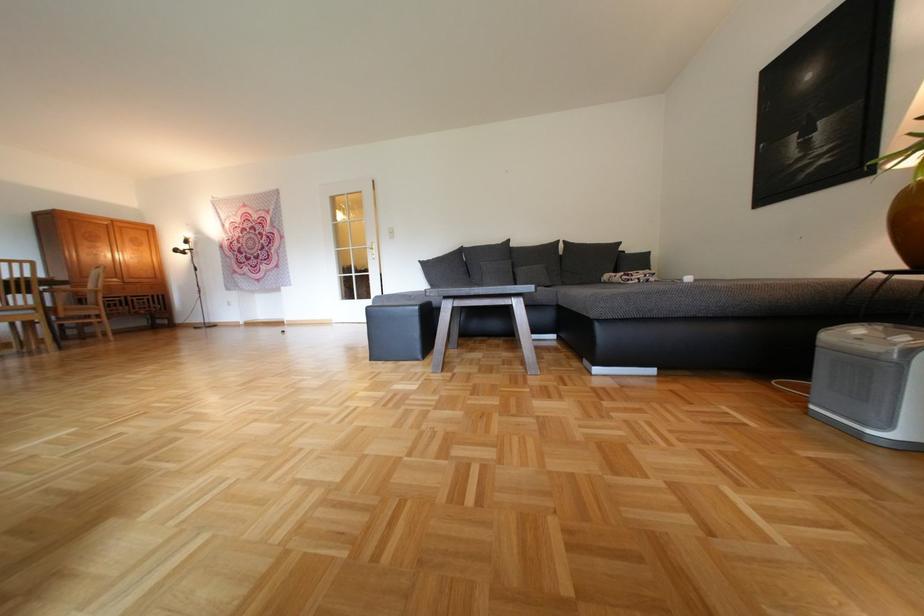
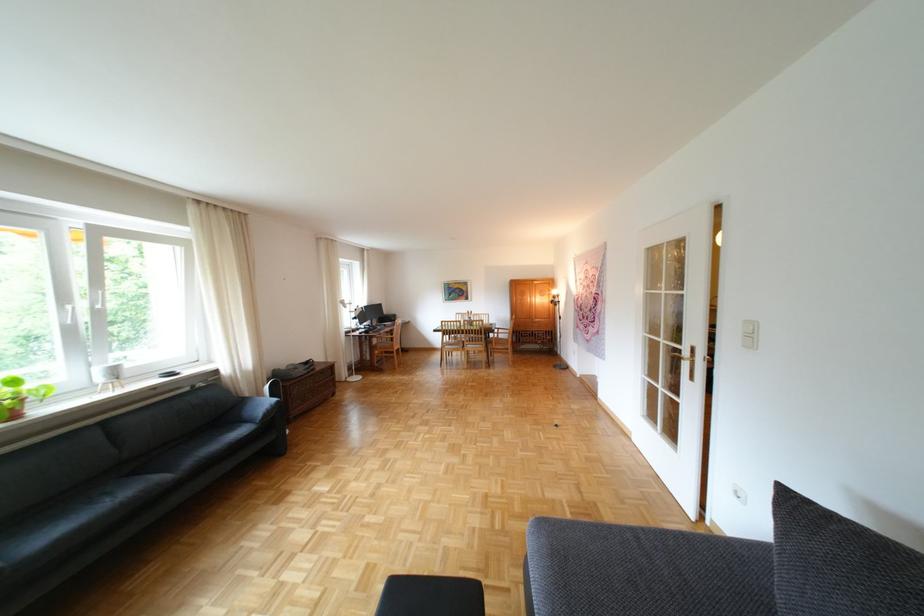
Where in the second image is the point corresponding to point (126, 221) from the first image?

(544, 281)